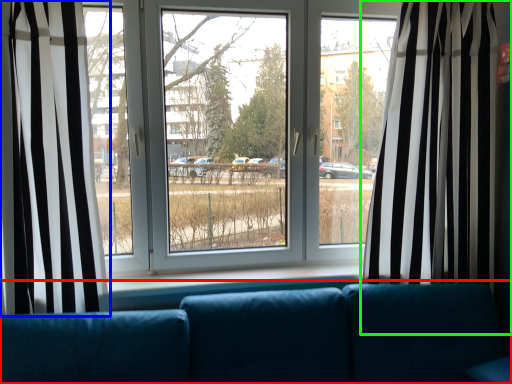
Question: Based on their relative distances, which object is nearer to studio couch (highlighted by a red box)? Choose from curtain (highlighted by a blue box) and curtain (highlighted by a green box).

Choices:
 (A) curtain
 (B) curtain

Answer: (B)